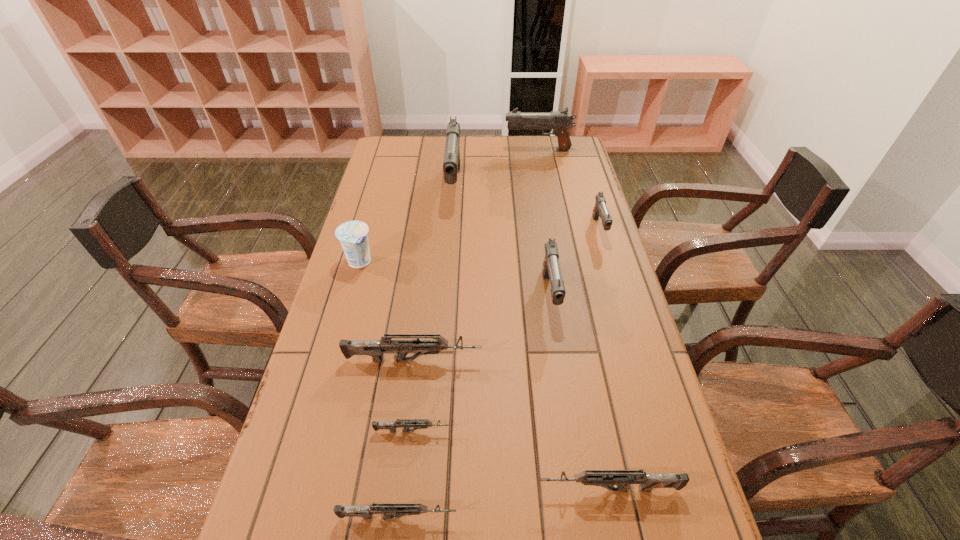
Where is `the tallest object`? The height and width of the screenshot is (540, 960). the tallest object is located at coordinates (451, 164).

The width and height of the screenshot is (960, 540). I want to click on the seventh nearest gun, so click(451, 164).

Find the location of a particular element. The height and width of the screenshot is (540, 960). the second biggest gray gun is located at coordinates (560, 121).

Where is `the farthest object`? This screenshot has width=960, height=540. the farthest object is located at coordinates (560, 121).

You are a GUI agent. You are given a task and a screenshot of the screen. Output one action in this format:
    pyautogui.click(x=<x>, y=<y>)
    Task: Click on the fourth farthest gun
    The image size is (960, 540).
    Given the screenshot: What is the action you would take?
    pyautogui.click(x=551, y=269)

Where is `the second smallest gray gun`? Image resolution: width=960 pixels, height=540 pixels. the second smallest gray gun is located at coordinates (551, 269).

Locate an element on the screen. Image resolution: width=960 pixels, height=540 pixels. yogurt is located at coordinates (353, 235).

Find the location of `the second nearest gray gun`. the second nearest gray gun is located at coordinates (600, 209).

This screenshot has width=960, height=540. I want to click on the third farthest gun, so click(x=600, y=209).

The width and height of the screenshot is (960, 540). I want to click on the biggest grey gun, so click(375, 348).